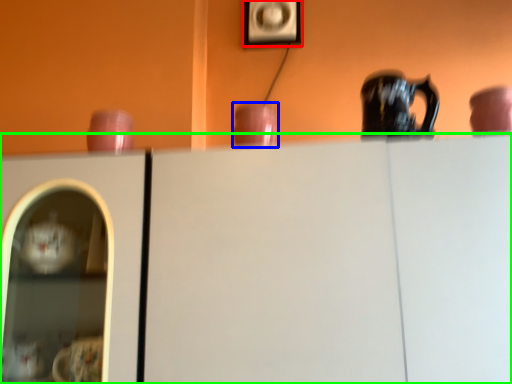
Question: Based on their relative distances, which object is farther from picture frame (highlighted by a red box)? Choose from tableware (highlighted by a blue box) and cabinetry (highlighted by a green box).

Choices:
 (A) tableware
 (B) cabinetry

Answer: (B)